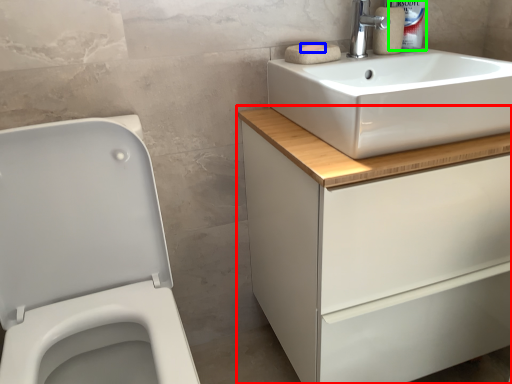
Question: Which object is the farthest from bathroom cabinet (highlighted by a red box)? Choose among these: soap (highlighted by a blue box) or cleaning product (highlighted by a green box).

Choices:
 (A) soap
 (B) cleaning product

Answer: (B)